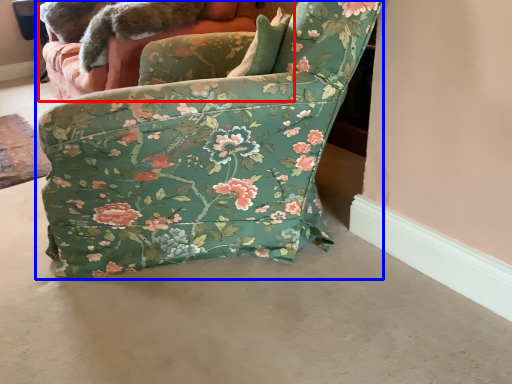
Question: Which object appears farthest to the camera in this image, couch (highlighted by a red box) or chair (highlighted by a blue box)?

Choices:
 (A) couch
 (B) chair

Answer: (A)